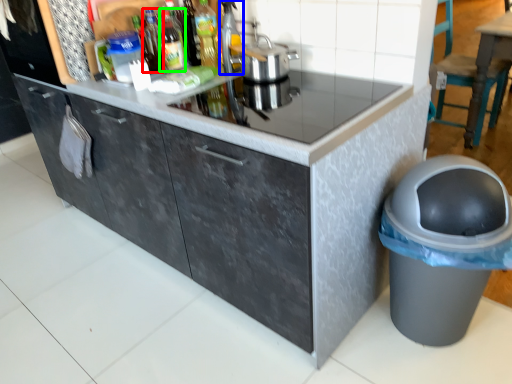
Question: Considering the real-world distances, which object is farthest from bottle (highlighted by a red box)? appliance (highlighted by a blue box) or bottle (highlighted by a green box)?

Choices:
 (A) appliance
 (B) bottle

Answer: (A)